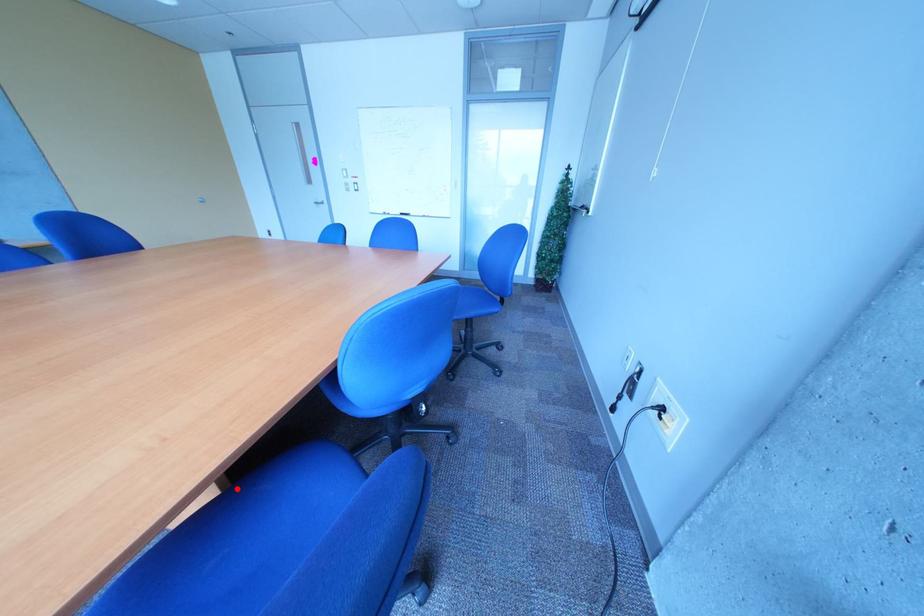
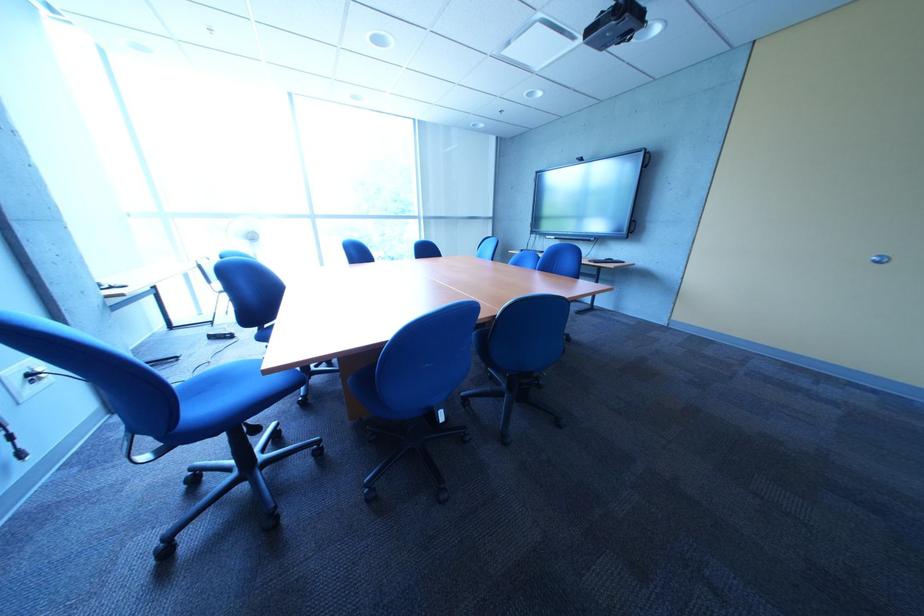
Question: I am providing you with two images of the same scene from different viewpoints. A red point is marked on the first image. Is the red point's position out of view in image 2?

Choices:
 (A) Yes
 (B) No

Answer: (A)